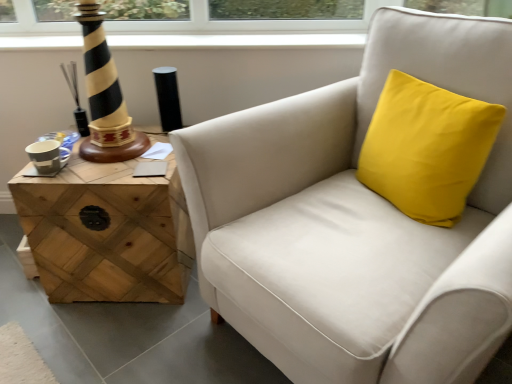
Question: Is matte white armchair at center next to woodenmaterial/texturetable at left and touching it?

Choices:
 (A) yes
 (B) no

Answer: (B)

Question: From the image's perspective, is matte white armchair at center above woodenmaterial/texturetable at left?

Choices:
 (A) no
 (B) yes

Answer: (B)

Question: Can woodenmaterial/texturetable at left be found inside matte white armchair at center?

Choices:
 (A) no
 (B) yes

Answer: (A)

Question: Is matte white armchair at center smaller than woodenmaterial/texturetable at left?

Choices:
 (A) yes
 (B) no

Answer: (B)

Question: Does matte white armchair at center have a greater height compared to woodenmaterial/texturetable at left?

Choices:
 (A) no
 (B) yes

Answer: (B)

Question: From the image's perspective, does matte white armchair at center appear lower than woodenmaterial/texturetable at left?

Choices:
 (A) no
 (B) yes

Answer: (A)

Question: Does matte white armchair at center come behind yellow fabric cushion at upper right?

Choices:
 (A) yes
 (B) no

Answer: (B)

Question: From the image's perspective, is matte white armchair at center located above yellow fabric cushion at upper right?

Choices:
 (A) no
 (B) yes

Answer: (A)

Question: From a real-world perspective, is matte white armchair at center located higher than yellow fabric cushion at upper right?

Choices:
 (A) yes
 (B) no

Answer: (B)

Question: Considering the relative sizes of matte white armchair at center and yellow fabric cushion at upper right in the image provided, is matte white armchair at center smaller than yellow fabric cushion at upper right?

Choices:
 (A) no
 (B) yes

Answer: (A)

Question: Is matte white armchair at center turned away from yellow fabric cushion at upper right?

Choices:
 (A) yes
 (B) no

Answer: (A)

Question: Considering the relative sizes of matte white armchair at center and yellow fabric cushion at upper right in the image provided, is matte white armchair at center shorter than yellow fabric cushion at upper right?

Choices:
 (A) yes
 (B) no

Answer: (B)

Question: Is yellow fabric cushion at upper right in contact with matte white armchair at center?

Choices:
 (A) yes
 (B) no

Answer: (B)